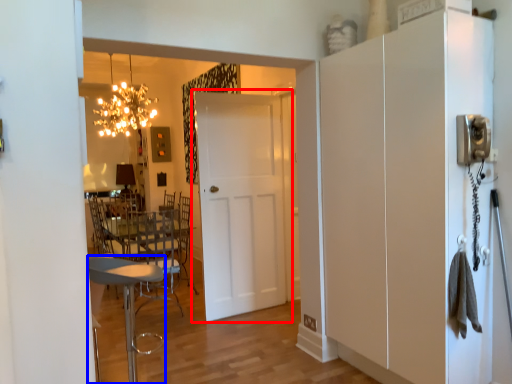
Question: Which of the following is the closest to the observer, door (highlighted by a red box) or chair (highlighted by a blue box)?

Choices:
 (A) door
 (B) chair

Answer: (B)